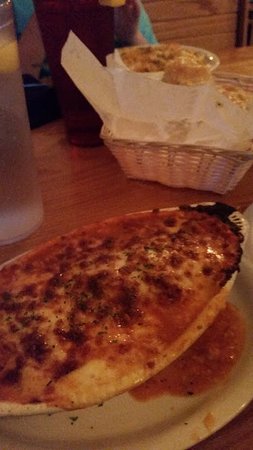
This screenshot has width=253, height=450. In order to click on wall in this screenshot , I will do `click(193, 15)`.